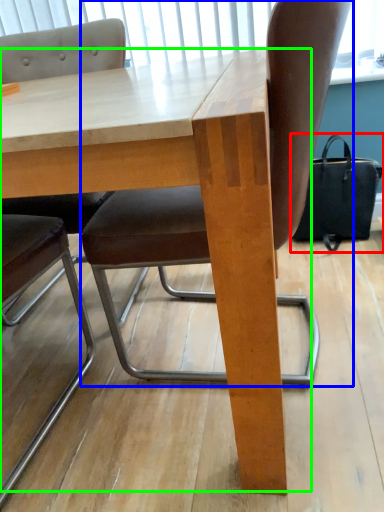
Question: Which object is the closest to the handbag (highlighted by a red box)? Choose among these: chair (highlighted by a blue box) or table (highlighted by a green box).

Choices:
 (A) chair
 (B) table

Answer: (A)